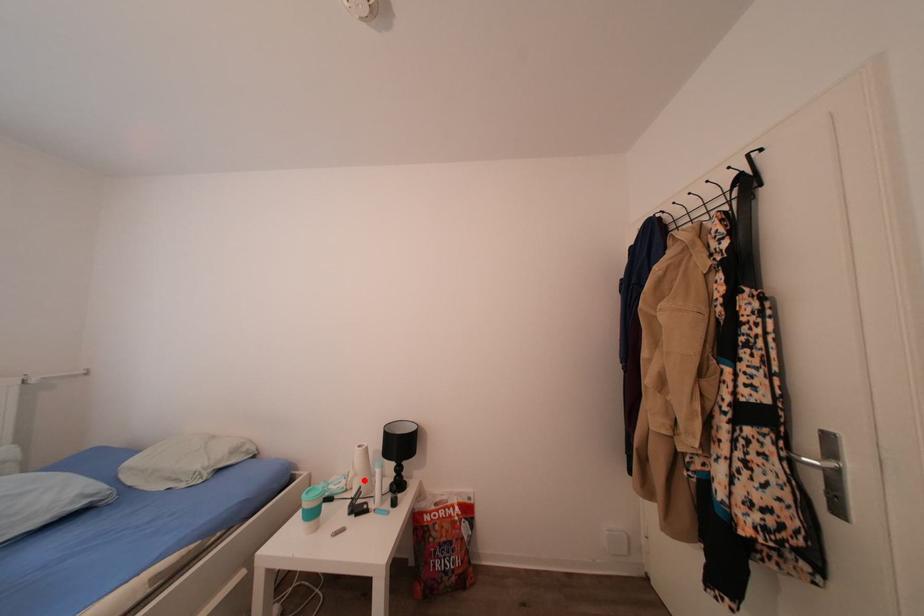
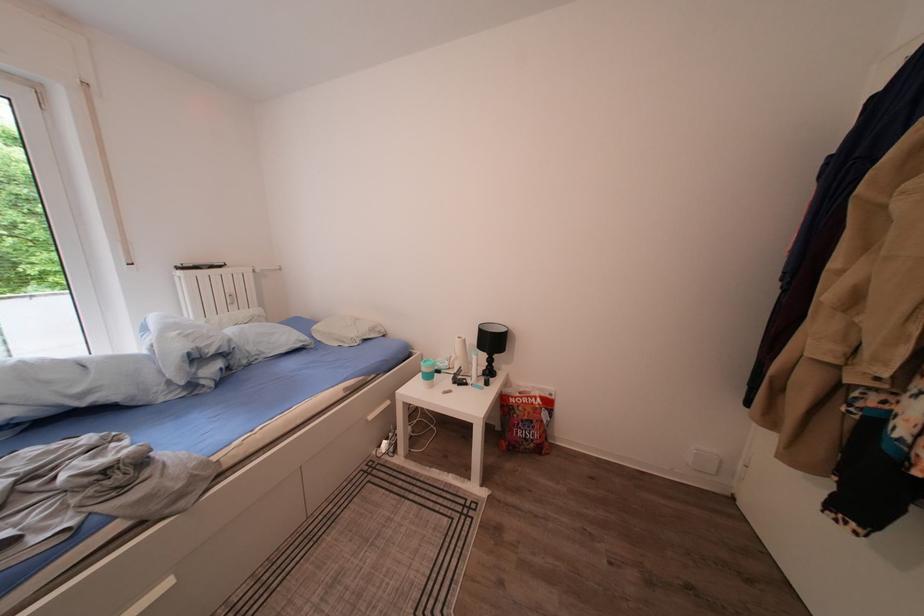
In the second image, find the point that corresponds to the highlighted location in the first image.

(466, 363)